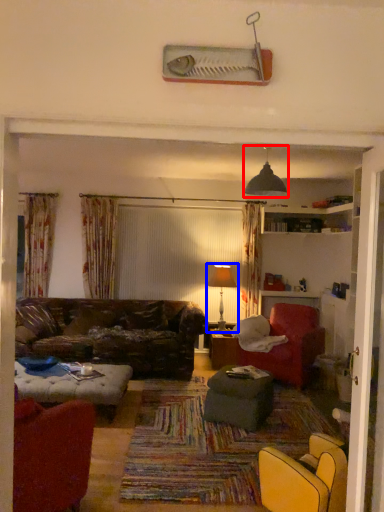
Question: Among these objects, which one is nearest to the camera, light fixture (highlighted by a red box) or table lamp (highlighted by a blue box)?

Choices:
 (A) light fixture
 (B) table lamp

Answer: (A)